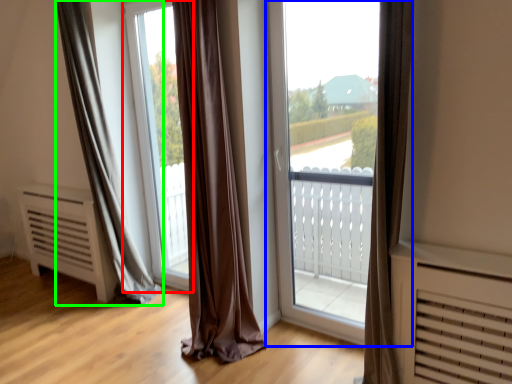
Question: Which object is the farthest from window screen (highlighted by a red box)? Choose among these: window (highlighted by a blue box) or curtain (highlighted by a green box).

Choices:
 (A) window
 (B) curtain

Answer: (A)